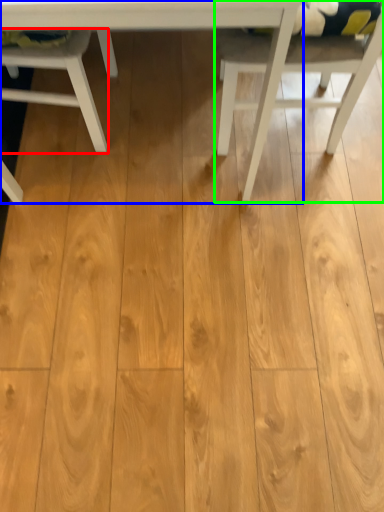
Question: Which is farther away from chair (highlighted by a red box)? table (highlighted by a blue box) or chair (highlighted by a green box)?

Choices:
 (A) table
 (B) chair

Answer: (B)